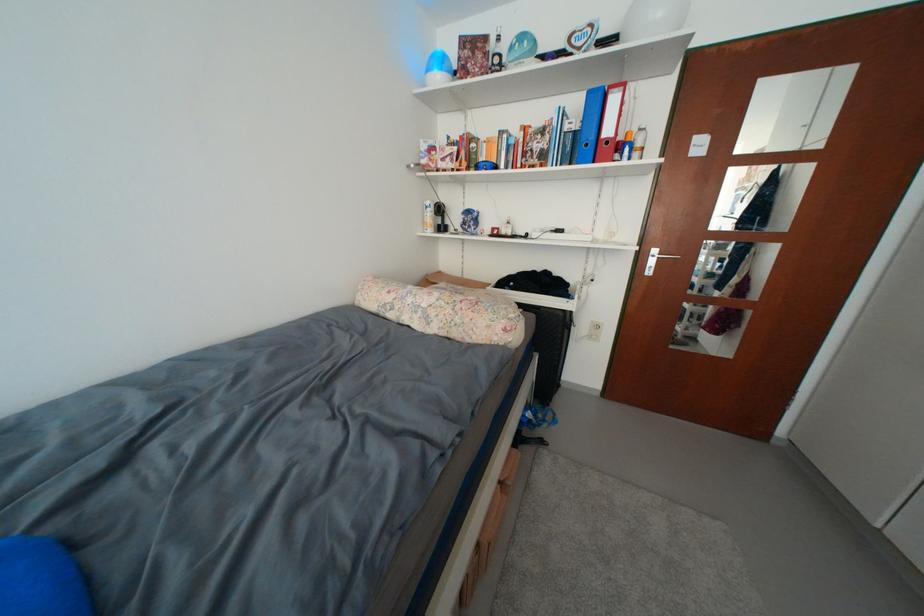
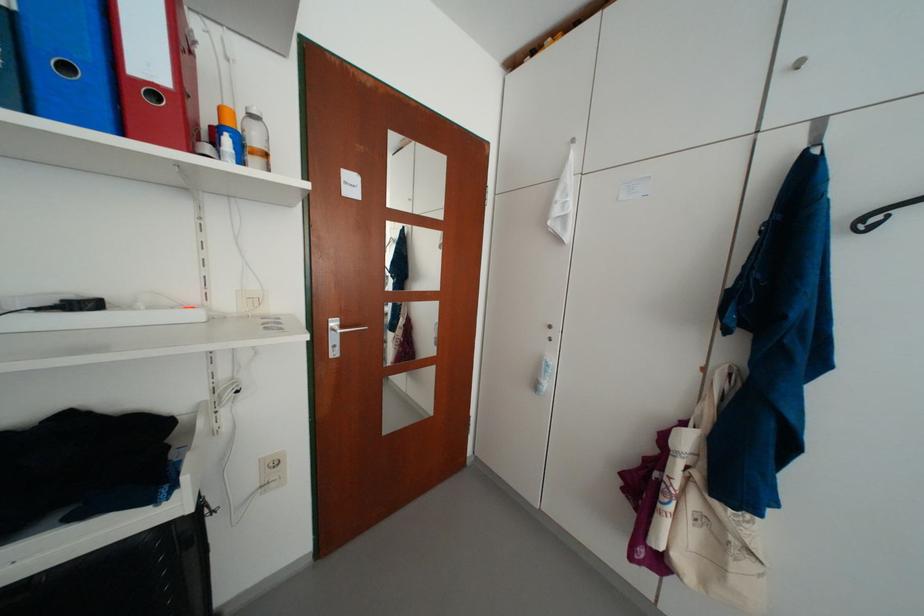
The point at [602,164] is marked in the first image. Where is the corresponding point in the second image?

(130, 136)